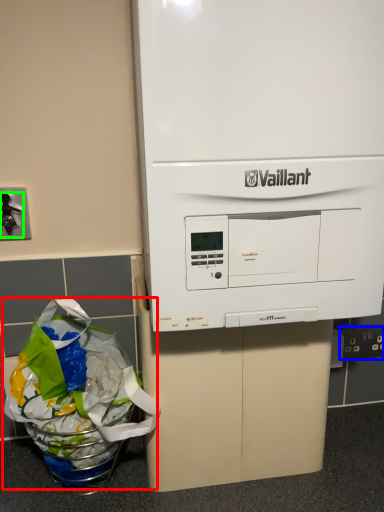
Question: Based on their relative distances, which object is farther from grocery bag (highlighted by a red box)? Choose from electric outlet (highlighted by a blue box) and faucet (highlighted by a green box).

Choices:
 (A) electric outlet
 (B) faucet

Answer: (A)